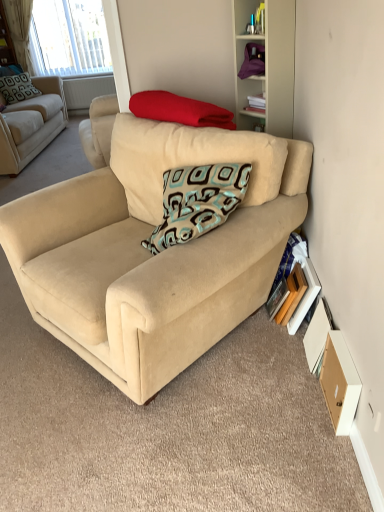
The image size is (384, 512). I want to click on free space that is to the left of wooden drawer at lower right, so click(x=298, y=409).